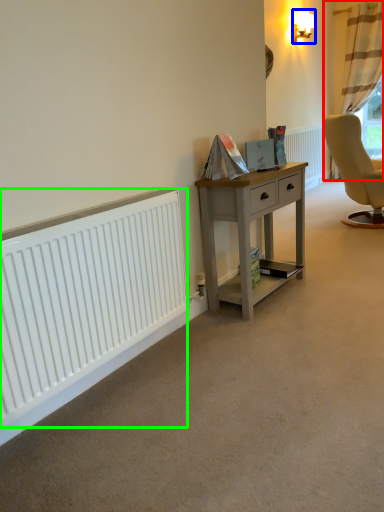
Question: Considering the real-world distances, which object is closest to curtain (highlighted by a red box)? lamp (highlighted by a blue box) or radiator (highlighted by a green box).

Choices:
 (A) lamp
 (B) radiator

Answer: (A)